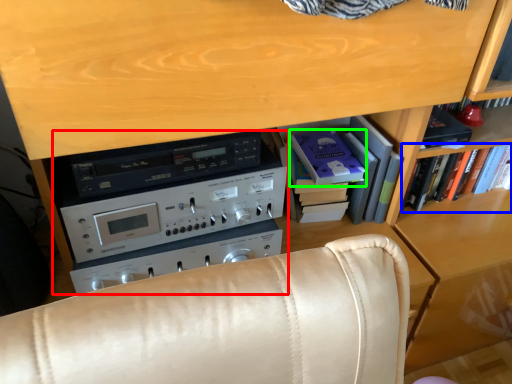
Question: Which object is positioned closest to appliance (highlighted by a red box)? Select from book (highlighted by a blue box) and paperback book (highlighted by a green box).

Choices:
 (A) book
 (B) paperback book

Answer: (B)